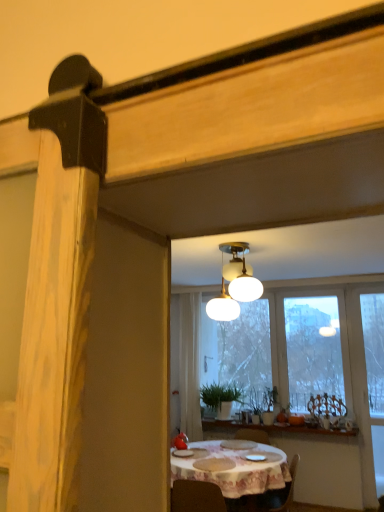
Question: Should I look upward or downward to see white sheer curtain at center?

Choices:
 (A) down
 (B) up

Answer: (A)

Question: Does white frosted glass lamp at upper center have a smaller size compared to white sheer curtain at center?

Choices:
 (A) yes
 (B) no

Answer: (A)

Question: Is white frosted glass lamp at upper center to the right of white sheer curtain at center from the viewer's perspective?

Choices:
 (A) yes
 (B) no

Answer: (A)

Question: Is white frosted glass lamp at upper center oriented away from white sheer curtain at center?

Choices:
 (A) no
 (B) yes

Answer: (A)

Question: Does white frosted glass lamp at upper center have a greater height compared to white sheer curtain at center?

Choices:
 (A) no
 (B) yes

Answer: (A)

Question: Can you confirm if white frosted glass lamp at upper center is thinner than white sheer curtain at center?

Choices:
 (A) no
 (B) yes

Answer: (A)

Question: From a real-world perspective, is white frosted glass lamp at upper center positioned under white sheer curtain at center based on gravity?

Choices:
 (A) yes
 (B) no

Answer: (B)

Question: Is green matte plant at center oriented away from transparent glass window at center?

Choices:
 (A) yes
 (B) no

Answer: (A)

Question: Does green matte plant at center turn towards transparent glass window at center?

Choices:
 (A) no
 (B) yes

Answer: (A)

Question: From a real-world perspective, is green matte plant at center physically above transparent glass window at center?

Choices:
 (A) yes
 (B) no

Answer: (B)

Question: Is green matte plant at center positioned far away from transparent glass window at center?

Choices:
 (A) yes
 (B) no

Answer: (B)

Question: Is green matte plant at center behind transparent glass window at center?

Choices:
 (A) no
 (B) yes

Answer: (B)

Question: From a real-world perspective, is green matte plant at center under transparent glass window at center?

Choices:
 (A) yes
 (B) no

Answer: (A)

Question: From the image's perspective, is white frosted glass lamp at upper center under white ceramic window sill at center?

Choices:
 (A) yes
 (B) no

Answer: (B)